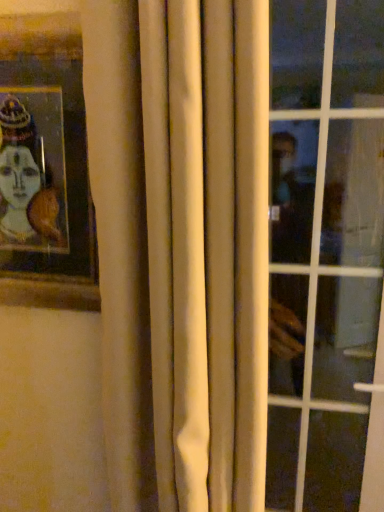
Question: Should I look upward or downward to see white fabric curtain at center?

Choices:
 (A) down
 (B) up

Answer: (A)

Question: Is white fabric curtain at center outside wooden picture frame at upper left?

Choices:
 (A) no
 (B) yes

Answer: (B)

Question: From the image's perspective, does white fabric curtain at center appear higher than wooden picture frame at upper left?

Choices:
 (A) yes
 (B) no

Answer: (B)

Question: Can you confirm if white fabric curtain at center is shorter than wooden picture frame at upper left?

Choices:
 (A) no
 (B) yes

Answer: (A)

Question: Is white fabric curtain at center oriented away from wooden picture frame at upper left?

Choices:
 (A) no
 (B) yes

Answer: (A)

Question: Is white fabric curtain at center closer to camera compared to wooden picture frame at upper left?

Choices:
 (A) no
 (B) yes

Answer: (B)

Question: Is white fabric curtain at center bigger than wooden picture frame at upper left?

Choices:
 (A) yes
 (B) no

Answer: (A)

Question: Is wooden picture frame at upper left wider than white fabric curtain at center?

Choices:
 (A) yes
 (B) no

Answer: (B)

Question: Does wooden picture frame at upper left appear on the left side of white fabric curtain at center?

Choices:
 (A) no
 (B) yes

Answer: (B)

Question: Can you see wooden picture frame at upper left touching white fabric curtain at center?

Choices:
 (A) no
 (B) yes

Answer: (A)

Question: From a real-world perspective, does wooden picture frame at upper left stand above white fabric curtain at center?

Choices:
 (A) yes
 (B) no

Answer: (A)

Question: Considering the relative positions of wooden picture frame at upper left and white fabric curtain at center in the image provided, is wooden picture frame at upper left to the right of white fabric curtain at center from the viewer's perspective?

Choices:
 (A) yes
 (B) no

Answer: (B)

Question: Is wooden picture frame at upper left further to camera compared to white fabric curtain at center?

Choices:
 (A) no
 (B) yes

Answer: (B)

Question: Is transparent glass window at right wider than wooden picture frame at upper left?

Choices:
 (A) yes
 (B) no

Answer: (A)